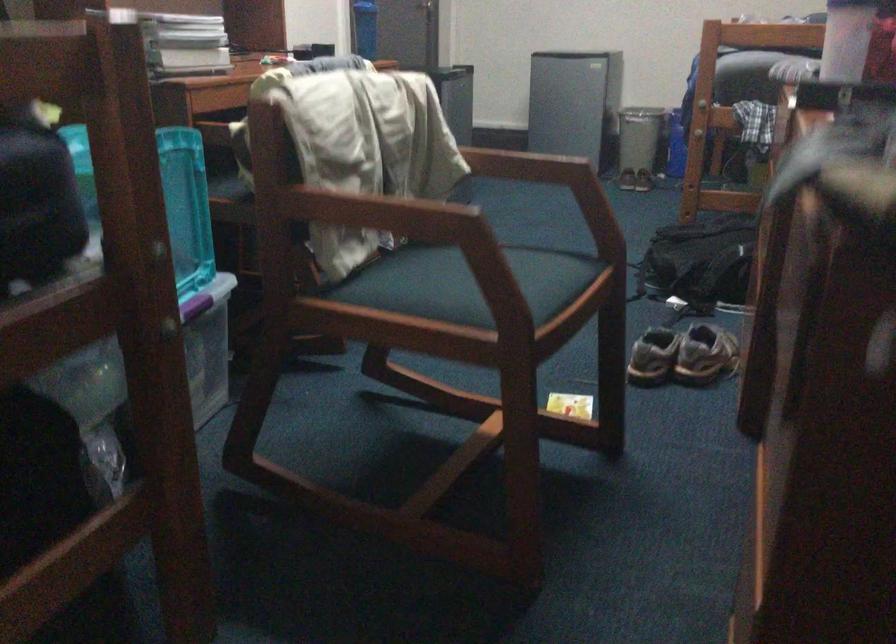
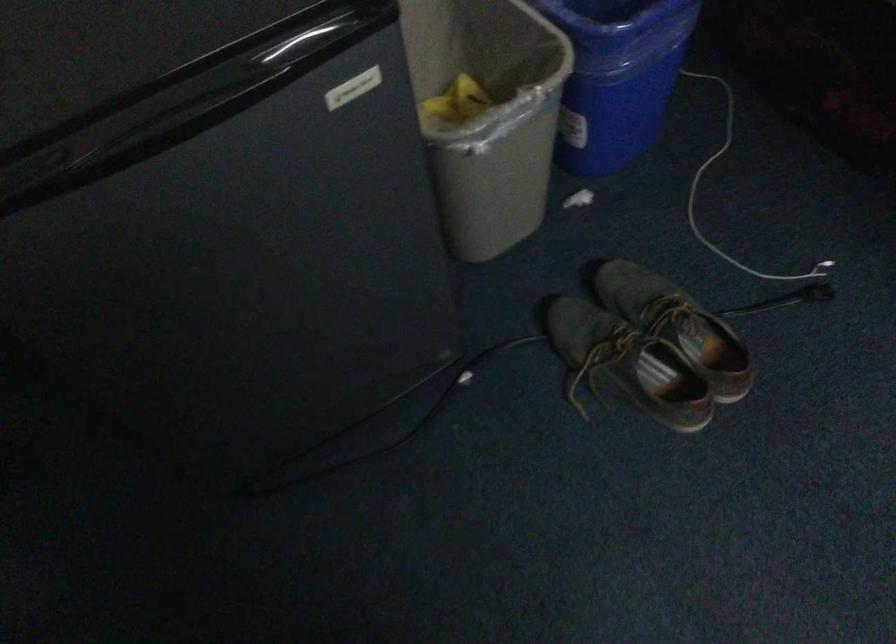
The point at [664,99] is marked in the first image. Where is the corresponding point in the second image?

(616, 76)